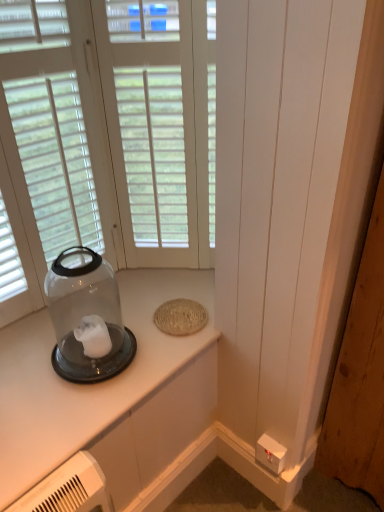
Measure the distance between transparent glass jar at left and camera.

transparent glass jar at left is 1.10 meters from camera.

Locate an element on the screen. The height and width of the screenshot is (512, 384). white wood window at center is located at coordinates (161, 125).

You are a GUI agent. You are given a task and a screenshot of the screen. Output one action in this format:
    pyautogui.click(x=<x>, y=<y>)
    Task: Click on the window above the transparent glass jar at left (from a real-world perspective)
    This screenshot has width=384, height=512.
    Given the screenshot: What is the action you would take?
    pyautogui.click(x=161, y=125)

Considering the relative sizes of transparent glass jar at left and white wood window at center in the image provided, is transparent glass jar at left taller than white wood window at center?

No, transparent glass jar at left is not taller than white wood window at center.

Is transparent glass jar at left at the right side of white wood window at center?

In fact, transparent glass jar at left is to the left of white wood window at center.

Does transparent glass jar at left turn towards white wood window at center?

No, transparent glass jar at left is not aimed at white wood window at center.

From the image's perspective, which object appears higher, white plastic electric outlet at lower right or clear glass jar at left?

clear glass jar at left.

Is point (281, 458) closer or farther from the camera than point (38, 333)?

Point (281, 458).

Considering the relative sizes of white plastic electric outlet at lower right and clear glass jar at left in the image provided, is white plastic electric outlet at lower right shorter than clear glass jar at left?

No.

Which object is further away from the camera, white plastic electric outlet at lower right or clear glass jar at left?

white plastic electric outlet at lower right.

Is transparent glass jar at left to the left of clear glass jar at left from the viewer's perspective?

Indeed, transparent glass jar at left is positioned on the left side of clear glass jar at left.

Which of these two, transparent glass jar at left or clear glass jar at left, is smaller?

clear glass jar at left.

Is transparent glass jar at left not near clear glass jar at left?

No, transparent glass jar at left is in close proximity to clear glass jar at left.

Is transparent glass jar at left wider than clear glass jar at left?

No, transparent glass jar at left is not wider than clear glass jar at left.

Looking at this image, does white wood window at center touch transparent glass jar at left?

white wood window at center and transparent glass jar at left are clearly separated.

From a real-world perspective, does white wood window at center sit lower than transparent glass jar at left?

Actually, white wood window at center is physically above transparent glass jar at left in the real world.

Is the depth of white wood window at center greater than that of transparent glass jar at left?

That is True.

Would you say white wood window at center is inside or outside transparent glass jar at left?

white wood window at center exists outside the volume of transparent glass jar at left.

Considering the relative sizes of white wood window at center and clear glass jar at left in the image provided, is white wood window at center smaller than clear glass jar at left?

Yes, white wood window at center is smaller than clear glass jar at left.

Looking at their sizes, would you say white wood window at center is wider or thinner than clear glass jar at left?

Clearly, white wood window at center has less width compared to clear glass jar at left.

From the picture: Is white wood window at center facing away from clear glass jar at left?

No.

From a real-world perspective, does white wood window at center stand above clear glass jar at left?

Indeed, from a real-world perspective, white wood window at center stands above clear glass jar at left.

From a real-world perspective, is white wood window at center physically located above or below white plastic electric outlet at lower right?

white wood window at center is situated higher than white plastic electric outlet at lower right in the real world.

Does white wood window at center touch white plastic electric outlet at lower right?

They are not placed beside each other.

Considering the relative positions of clear glass jar at left and white wood window at center in the image provided, is clear glass jar at left to the right of white wood window at center from the viewer's perspective?

No, clear glass jar at left is not to the right of white wood window at center.

Considering the relative sizes of clear glass jar at left and white wood window at center in the image provided, is clear glass jar at left shorter than white wood window at center?

Correct, clear glass jar at left is not as tall as white wood window at center.

Is clear glass jar at left oriented away from white wood window at center?

No, white wood window at center is not at the back of clear glass jar at left.

Can you confirm if clear glass jar at left is wider than white wood window at center?

Correct, the width of clear glass jar at left exceeds that of white wood window at center.

Image resolution: width=384 pixels, height=512 pixels. In the image, there is a white wood window at center. Find the location of `glass vase below it (from the image's perspective)`. glass vase below it (from the image's perspective) is located at coordinates (87, 317).

The width and height of the screenshot is (384, 512). What are the coordinates of `electric outlet on the right of clear glass jar at left` in the screenshot? It's located at pos(270,453).

Which object lies further to the anchor point white wood window at center, transparent glass jar at left or white plastic electric outlet at lower right?

white plastic electric outlet at lower right is positioned further to the anchor white wood window at center.

Estimate the real-world distances between objects in this image. Which object is further from white plastic electric outlet at lower right, transparent glass jar at left or clear glass jar at left?

The object further to white plastic electric outlet at lower right is transparent glass jar at left.

Estimate the real-world distances between objects in this image. Which object is closer to white plastic electric outlet at lower right, white wood window at center or clear glass jar at left?

clear glass jar at left is closer to white plastic electric outlet at lower right.

Looking at the image, which one is located closer to white wood window at center, clear glass jar at left or transparent glass jar at left?

transparent glass jar at left lies closer to white wood window at center than the other object.

When comparing their distances from white plastic electric outlet at lower right, does transparent glass jar at left or white wood window at center seem further?

Among the two, white wood window at center is located further to white plastic electric outlet at lower right.

Looking at the image, which one is located further to clear glass jar at left, transparent glass jar at left or white plastic electric outlet at lower right?

white plastic electric outlet at lower right is further to clear glass jar at left.

From the picture: When comparing their distances from transparent glass jar at left, does clear glass jar at left or white wood window at center seem closer?

Based on the image, clear glass jar at left appears to be nearer to transparent glass jar at left.

Estimate the real-world distances between objects in this image. Which object is closer to transparent glass jar at left, clear glass jar at left or white plastic electric outlet at lower right?

clear glass jar at left is positioned closer to the anchor transparent glass jar at left.

Where is `countertop between transparent glass jar at left and white plastic electric outlet at lower right from left to right`? This screenshot has height=512, width=384. countertop between transparent glass jar at left and white plastic electric outlet at lower right from left to right is located at coordinates (86, 385).

The height and width of the screenshot is (512, 384). Find the location of `glass vase between white wood window at center and white plastic electric outlet at lower right from top to bottom`. glass vase between white wood window at center and white plastic electric outlet at lower right from top to bottom is located at coordinates (87, 317).

You are a GUI agent. You are given a task and a screenshot of the screen. Output one action in this format:
    pyautogui.click(x=<x>, y=<y>)
    Task: Click on the glass vase between white wood window at center and clear glass jar at left from top to bottom
    This screenshot has width=384, height=512.
    Given the screenshot: What is the action you would take?
    pyautogui.click(x=87, y=317)

This screenshot has width=384, height=512. What are the coordinates of `countertop between white wood window at center and white plastic electric outlet at lower right from top to bottom` in the screenshot? It's located at (86, 385).